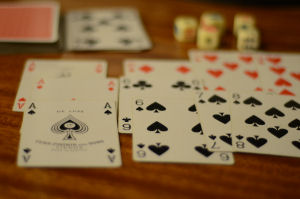
You are a GUI agent. You are given a task and a screenshot of the screen. Output one action in this format:
    pyautogui.click(x=<x>, y=<y>)
    Task: Click on the wood stain/varnish
    This screenshot has height=199, width=300.
    Given the screenshot: What is the action you would take?
    pyautogui.click(x=75, y=194), pyautogui.click(x=107, y=182), pyautogui.click(x=254, y=174), pyautogui.click(x=229, y=185), pyautogui.click(x=234, y=175), pyautogui.click(x=253, y=161), pyautogui.click(x=159, y=57), pyautogui.click(x=159, y=29), pyautogui.click(x=153, y=14), pyautogui.click(x=6, y=90)